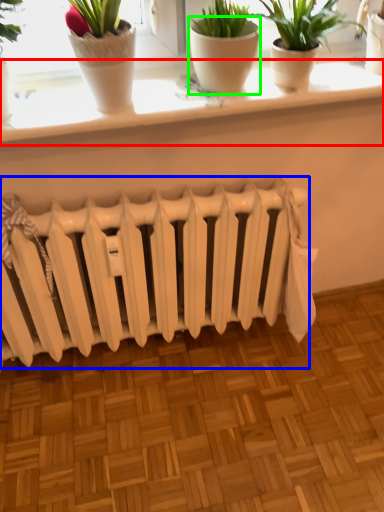
Question: Based on their relative distances, which object is nearer to window sill (highlighted by a red box)? Choose from radiator (highlighted by a blue box) and flowerpot (highlighted by a green box).

Choices:
 (A) radiator
 (B) flowerpot

Answer: (B)